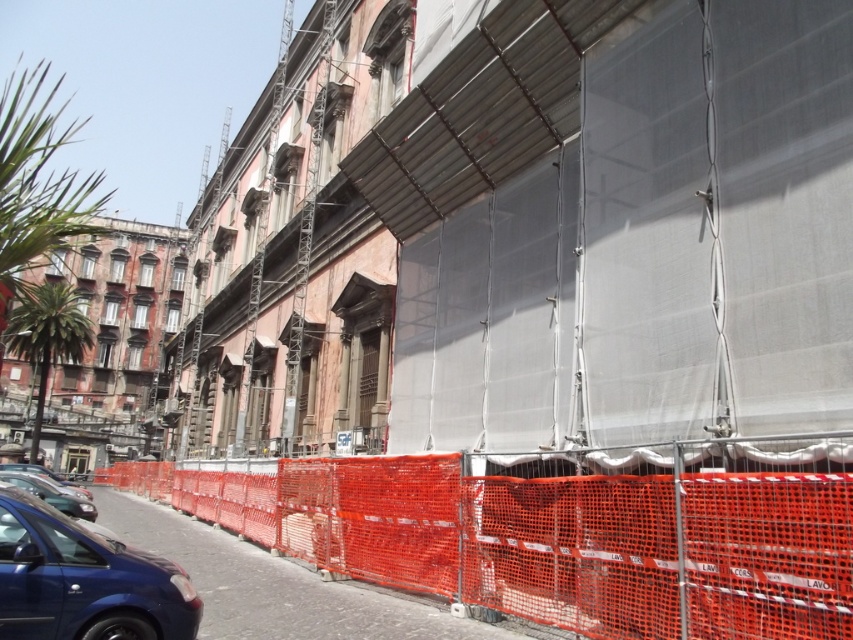
This screenshot has height=640, width=853. I want to click on matte black car at lower left, so click(51, 496).

The width and height of the screenshot is (853, 640). Describe the element at coordinates (549, 538) in the screenshot. I see `orange mesh fence at lower left` at that location.

From the picture: Who is more forward, (338,460) or (57,509)?

Positioned in front is point (57,509).

Identify the location of orange mesh fence at lower left. The height and width of the screenshot is (640, 853). (549, 538).

What do you see at coordinates (549, 538) in the screenshot? The width and height of the screenshot is (853, 640). I see `orange mesh fence at lower left` at bounding box center [549, 538].

Based on the photo, between orange mesh fence at lower left and matte black car at lower left, which one has more height?

With more height is orange mesh fence at lower left.

Measure the distance between point [633,500] and camera.

A distance of 28.61 feet exists between point [633,500] and camera.

The image size is (853, 640). I want to click on orange mesh fence at lower left, so click(x=549, y=538).